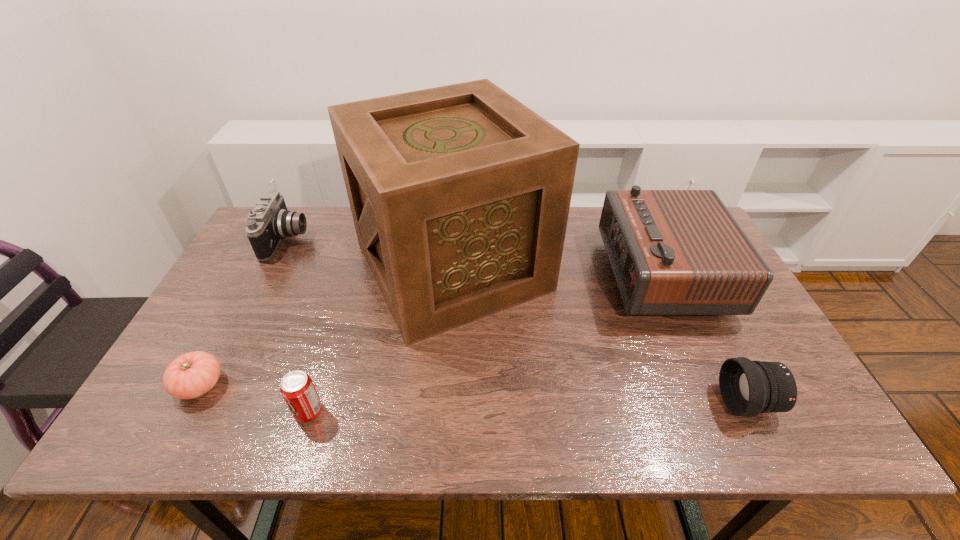
The height and width of the screenshot is (540, 960). In order to click on unoccupied area between the tomato and the soda in this screenshot , I will do `click(254, 399)`.

You are a GUI agent. You are given a task and a screenshot of the screen. Output one action in this format:
    pyautogui.click(x=<x>, y=<y>)
    Task: Click on the blank region between the soda and the box
    The height and width of the screenshot is (540, 960).
    Given the screenshot: What is the action you would take?
    pyautogui.click(x=380, y=340)

You are a GUI agent. You are given a task and a screenshot of the screen. Output one action in this format:
    pyautogui.click(x=<x>, y=<y>)
    Task: Click on the free area in between the radio receiver and the soda
    Image resolution: width=960 pixels, height=540 pixels.
    Given the screenshot: What is the action you would take?
    pyautogui.click(x=485, y=343)

Find the location of a particular element. The height and width of the screenshot is (540, 960). the fifth closest object to the soda is located at coordinates (748, 388).

Choose which object is the fourth nearest neighbor to the fifth shortest object. Please provide its 2D coordinates. Your answer should be formatted as a tuple, i.e. [(x, y)], where the tuple contains the x and y coordinates of a point satisfying the conditions above.

[(270, 221)]

At what (x,y) coordinates should I click in order to perform the action: click on vacant space that satisfies the following two spatial constraints: 1. on the front-facing side of the camera; 2. on the right side of the soda. Please return your answer as a coordinate pair (x, y). The image size is (960, 540). Looking at the image, I should click on (199, 412).

Image resolution: width=960 pixels, height=540 pixels. I want to click on vacant space that satisfies the following two spatial constraints: 1. at the front element of the telephoto lens; 2. on the front side of the soda, so click(754, 412).